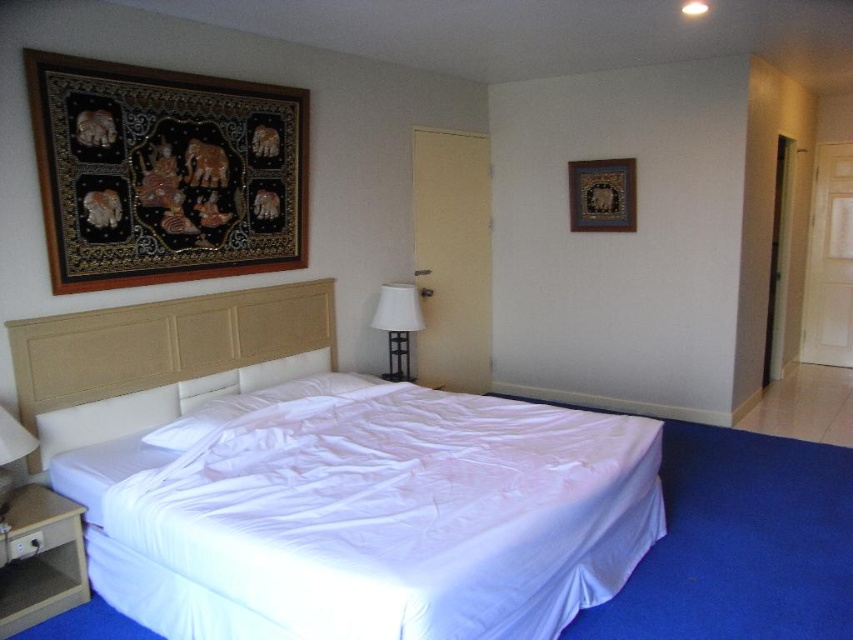
Question: Considering the relative positions of black fabric tapestry at upper left and gold textured picture frame at upper center in the image provided, where is black fabric tapestry at upper left located with respect to gold textured picture frame at upper center?

Choices:
 (A) left
 (B) right

Answer: (A)

Question: Which point is closer to the camera taking this photo?

Choices:
 (A) (67, 404)
 (B) (373, 312)
 (C) (314, 392)

Answer: (A)

Question: Which of the following is the closest to the observer?

Choices:
 (A) (213, 612)
 (B) (399, 288)
 (C) (236, 136)

Answer: (A)

Question: Among these points, which one is farthest from the camera?

Choices:
 (A) (577, 534)
 (B) (392, 310)
 (C) (573, 204)

Answer: (C)

Question: Is white fabric bed at center further to camera compared to black fabric tapestry at upper left?

Choices:
 (A) yes
 (B) no

Answer: (B)

Question: Is the position of white fabric bed at center more distant than that of white fabric lampshade at center?

Choices:
 (A) no
 (B) yes

Answer: (A)